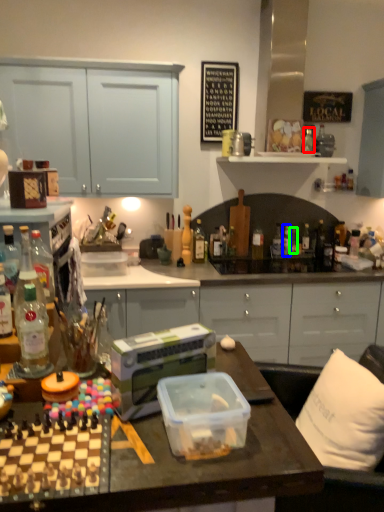
Question: Which object is the farthest from bottle (highlighted by a red box)? Choose among these: bottle (highlighted by a blue box) or bottle (highlighted by a green box).

Choices:
 (A) bottle
 (B) bottle

Answer: (B)